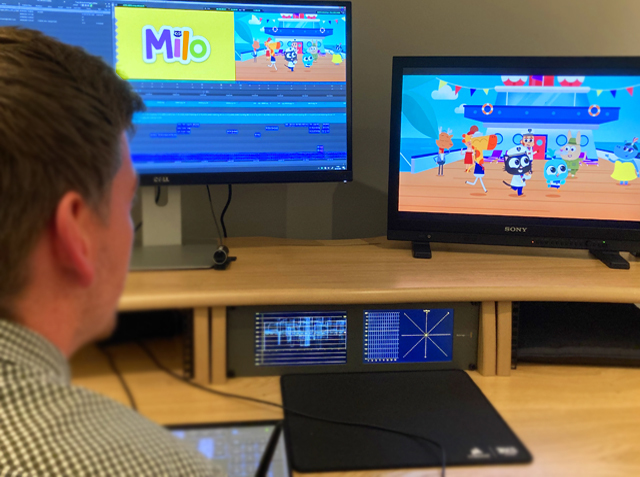
Where is `monitor`? Image resolution: width=640 pixels, height=477 pixels. monitor is located at coordinates (173, 208).